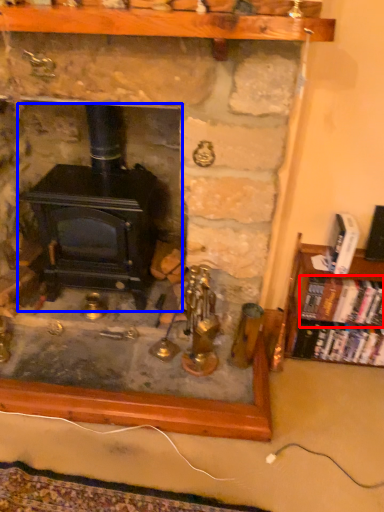
Question: Which object is further to the camera taking this photo, book (highlighted by a red box) or wood burning stove (highlighted by a blue box)?

Choices:
 (A) book
 (B) wood burning stove

Answer: (A)